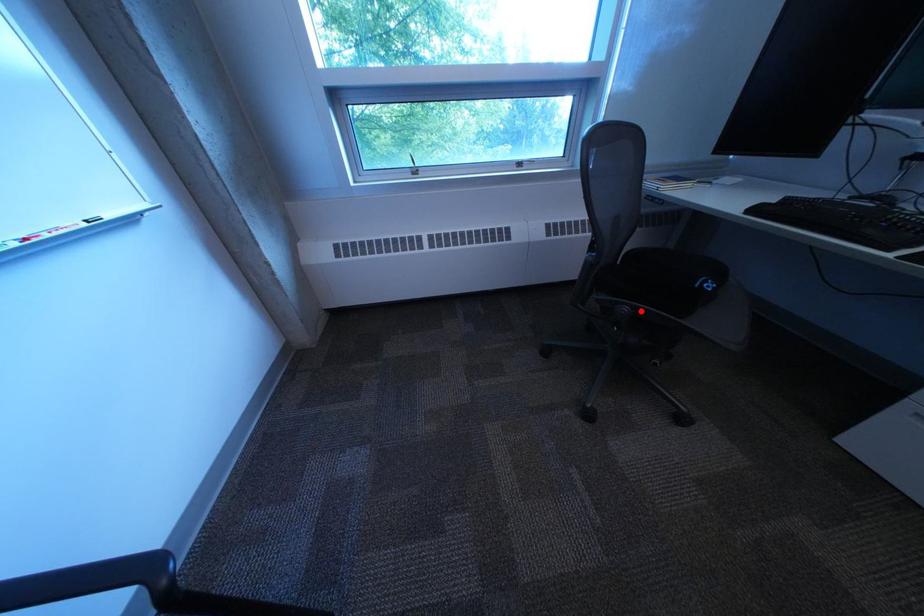
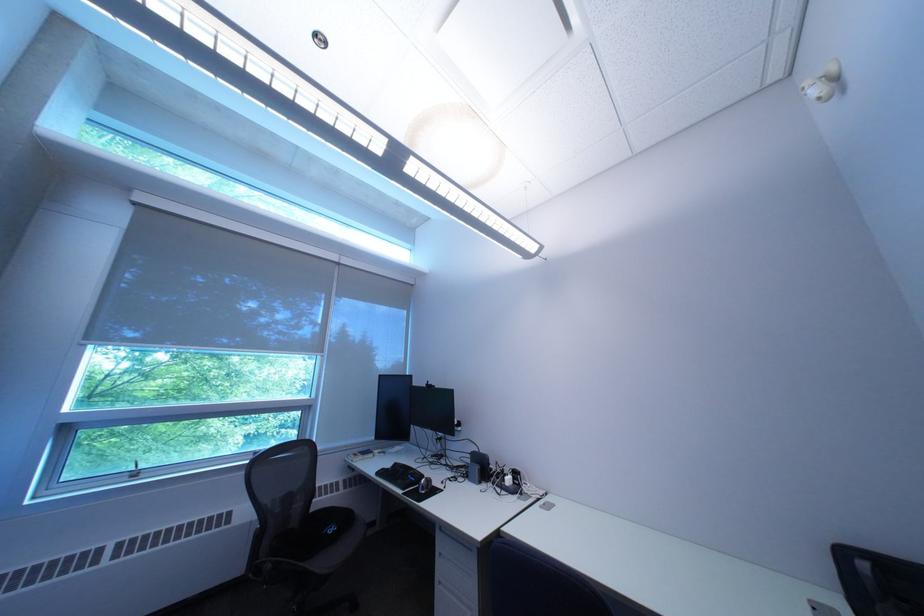
Find the pixel in the second image that matches the highlighted location in the first image.

(285, 568)